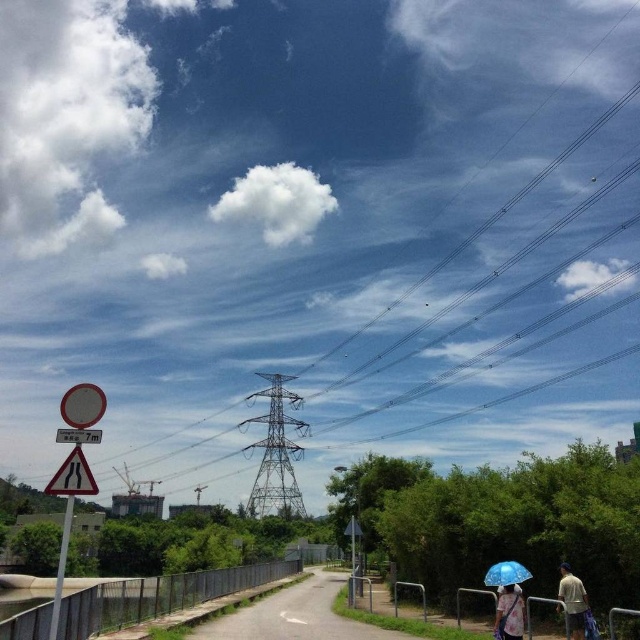
Question: Can you confirm if yellow reflective plastic road sign at lower left is positioned to the right of blue fabric umbrella at lower right?

Choices:
 (A) yes
 (B) no

Answer: (B)

Question: Can you confirm if metallic wire at upper center is positioned to the right of yellow reflective plastic road sign at lower left?

Choices:
 (A) no
 (B) yes

Answer: (B)

Question: Among these points, which one is nearest to the camera?

Choices:
 (A) (225, 173)
 (B) (524, 579)
 (C) (561, 564)

Answer: (B)

Question: Which of the following is the closest to the observer?

Choices:
 (A) click(x=522, y=630)
 (B) click(x=336, y=616)
 (C) click(x=472, y=205)

Answer: (A)

Question: Observing the image, what is the correct spatial positioning of smooth asphalt road at center in reference to blue fabric umbrella at lower right?

Choices:
 (A) below
 (B) above

Answer: (A)

Question: Which of the following is the closest to the observer?

Choices:
 (A) white plastic sign at lower left
 (B) light brown fabric shirt at lower right
 (C) smooth asphalt road at center
 (D) transparent blue umbrella at lower right

Answer: (A)